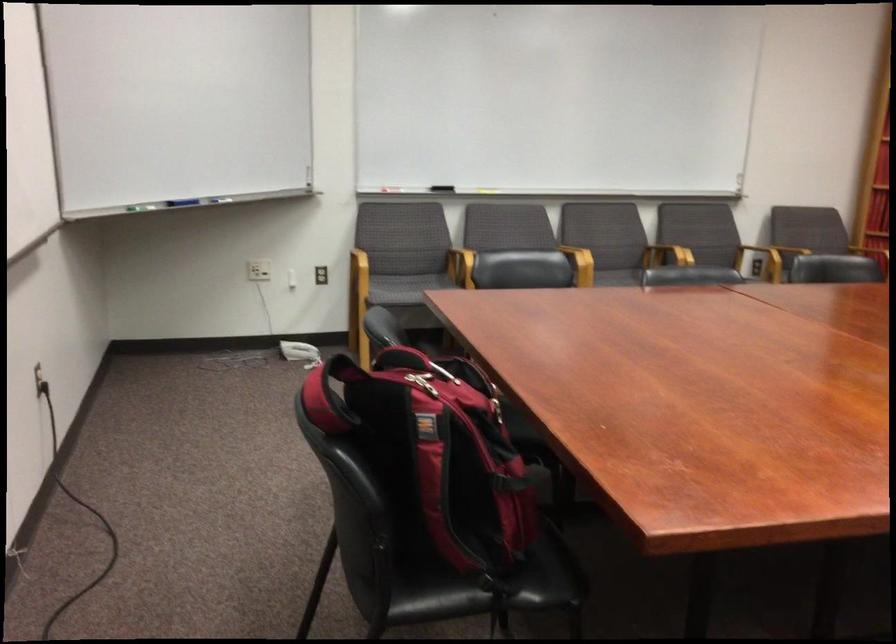
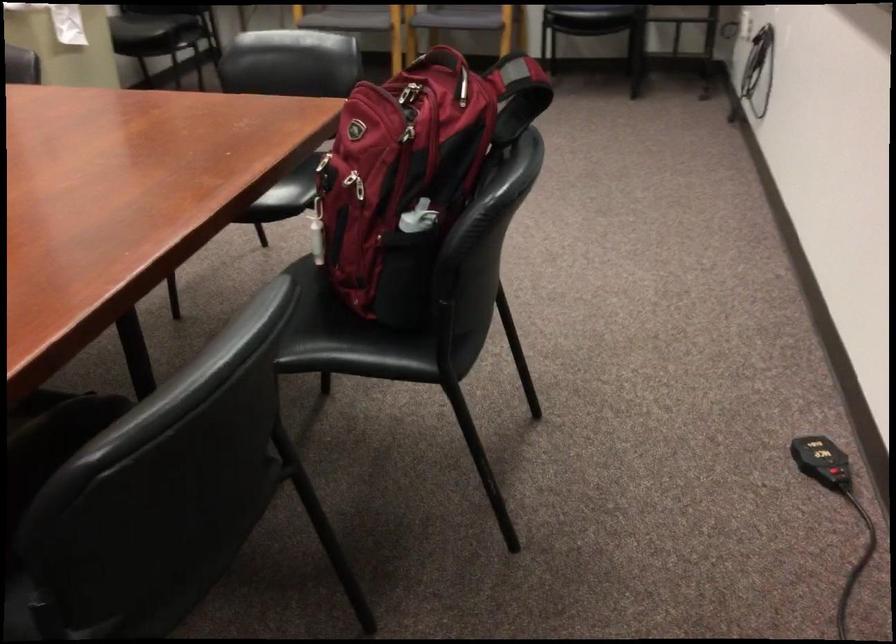
Find the pixel in the second image that matches pixel 641 450 in the first image.

(314, 153)